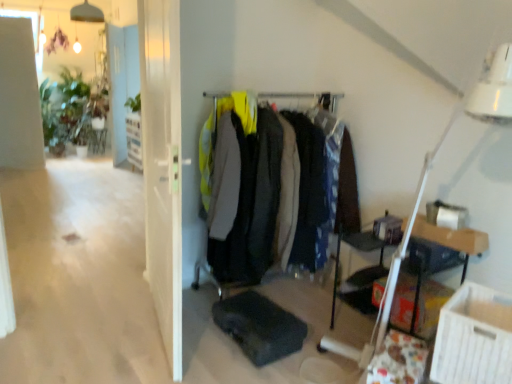
Locate an element on the screen. vacant space situated on the left part of transparent glass door at center is located at coordinates (96, 337).